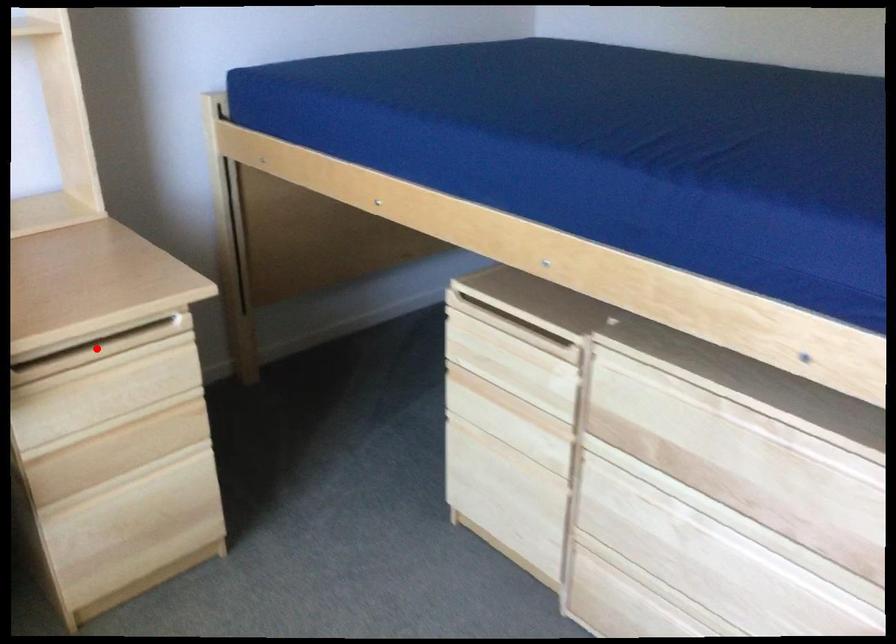
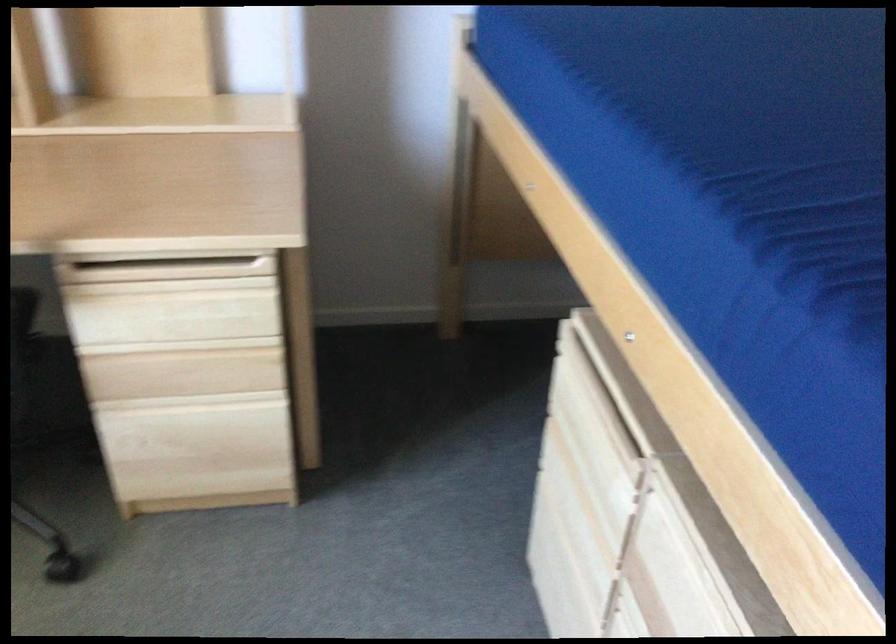
In the second image, find the point that corresponds to the highlighted location in the first image.

(166, 270)